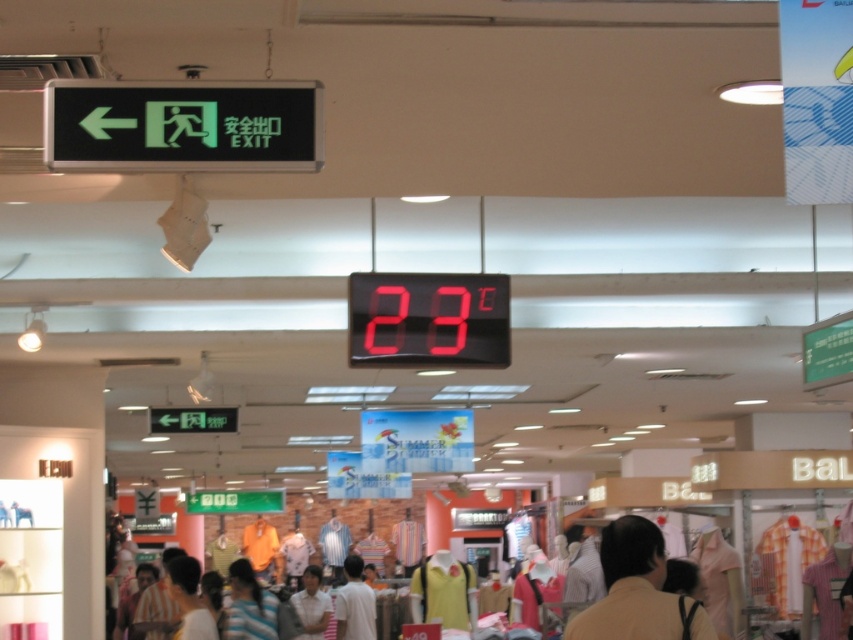
You are standing in the shopping mall and want to know which of the two points, point (341,609) or point (315,573), is closer to you. Can you determine this based on the scene?

Point (341,609) is closer to the viewer than point (315,573).

You are a customer in the mall looking at the light brown shirt at center and the white shirt at center. Which shirt is positioned to the right?

The light brown shirt at center is positioned to the right of the white shirt at center.

You are a customer looking at the brown fabric shirt at lower right and the white shirt at center in the mall. Which shirt is closer to you?

The brown fabric shirt at lower right is closer to you because it is in front of the white shirt at center.